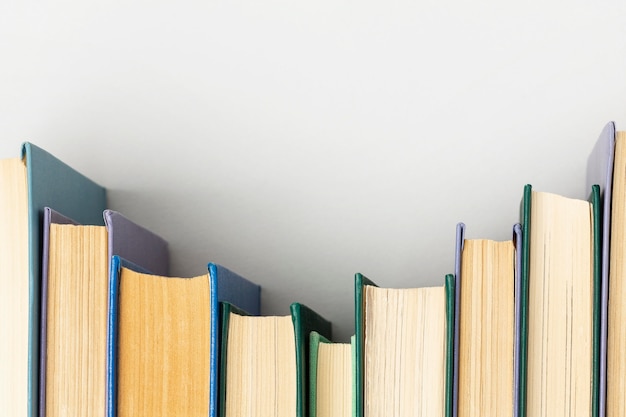
The image size is (626, 417). Find the location of `books`. books is located at coordinates (11, 228), (69, 312), (155, 382), (279, 361), (331, 405), (418, 360), (495, 304), (550, 249), (622, 170).